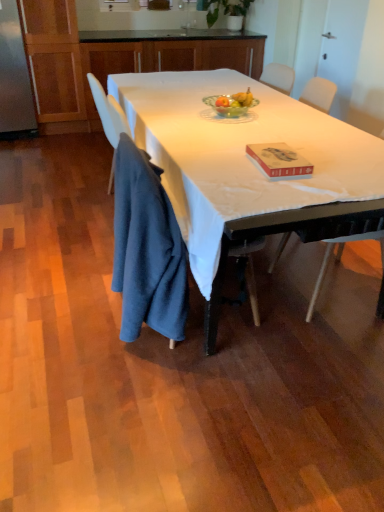
Locate an element on the screen. The image size is (384, 512). vacant space in front of red matte book at center is located at coordinates (265, 187).